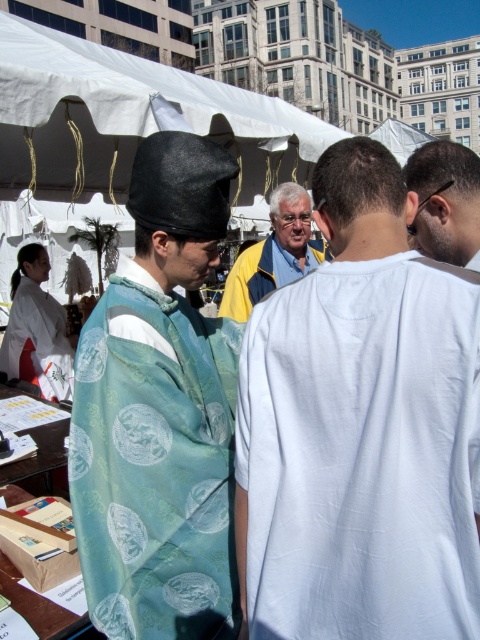
You are organizing a clothing display and need to arrange the white cotton shirt at center and the blue fabric shirt at center side by side. Which shirt should be placed on the left to ensure they fit within a 1.2 meter wide display area?

The white cotton shirt at center has a smaller width than the blue fabric shirt at center. To fit within the 1.2 meter display area, place the wider blue fabric shirt at center first, followed by the narrower white cotton shirt at center. This arrangement optimizes space usage.

Based on the photo, you are a photographer trying to capture a candid shot of the two people in the scene. You want to ensure both the white cotton shirt at center and the silk kimono at center are visible in your photo. Given their heights, which one might you need to adjust your camera angle to include fully?

The white cotton shirt at center is not as tall as the silk kimono at center, so you might need to lower your camera angle slightly to ensure the taller silk kimono at center is fully captured while still including the shorter white cotton shirt at center in the frame.

You are a photographer at the event and want to capture the white cotton shirt at center and the silk kimono at center in the same frame. Which one should you focus on first to ensure both are in focus?

The white cotton shirt at center is below the silk kimono at center. To ensure both are in focus, focus on the silk kimono at center first since it is closer to the camera, and the depth of field will likely include the white cotton shirt at center which is behind it.